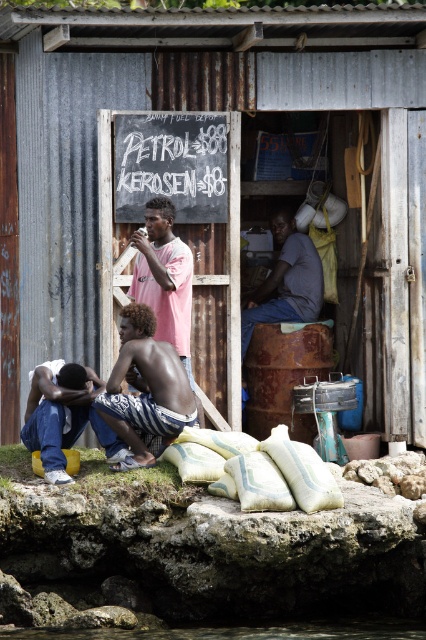
Question: Which of these objects is positioned closest to the denim jeans at lower left?

Choices:
 (A) rusty metal barrel at center
 (B) dark skin textured torso at lower center
 (C) matte gray shirt at center
 (D) clear water at lower center

Answer: (B)

Question: Which point is farther to the camera?

Choices:
 (A) (183, 326)
 (B) (161, 417)

Answer: (A)

Question: Is dark skin textured torso at lower center closer to camera compared to matte gray shirt at center?

Choices:
 (A) no
 (B) yes

Answer: (B)

Question: Estimate the real-world distances between objects in this image. Which object is farther from the pink cotton t-shirt at center?

Choices:
 (A) denim jeans at lower left
 (B) clear water at lower center

Answer: (B)

Question: Where is rusty metal barrel at center located in relation to denim jeans at lower left in the image?

Choices:
 (A) above
 (B) below

Answer: (A)

Question: Is dark skin textured torso at lower center to the right of pink cotton t-shirt at center from the viewer's perspective?

Choices:
 (A) no
 (B) yes

Answer: (A)